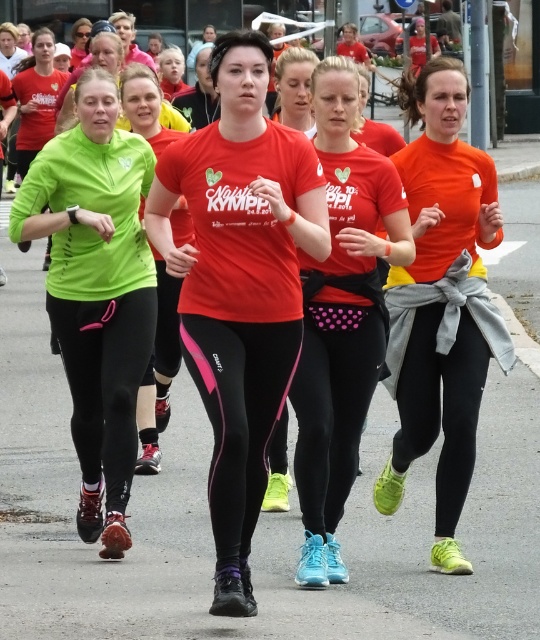
You are a photographer trying to capture a closeup shot of both the pink dotted leggings at center and the green matte leggings at center. Since you want to focus on their widths, which leggings should you zoom in on more to highlight their size difference?

The pink dotted leggings at center is wider than the green matte leggings at center, so you should zoom in more on the pink dotted leggings at center to emphasize their larger width compared to the green matte leggings at center.

You are a photographer trying to capture a clear shot of the matte orange shirt at center and the green matte leggings at center. Since both are at the center, which one is more visible in the photo?

The matte orange shirt at center is positioned over green matte leggings at center, so the matte orange shirt at center is more visible in the photo.